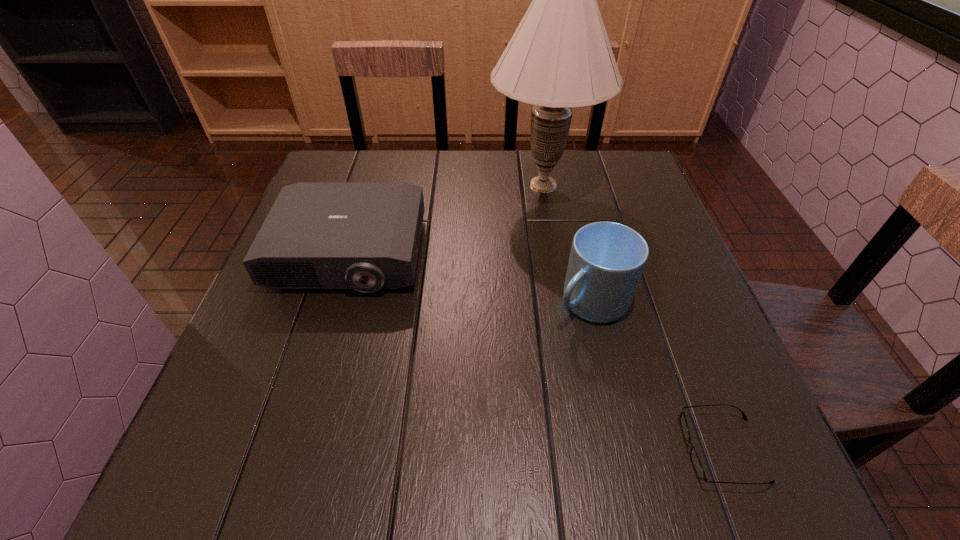
This screenshot has height=540, width=960. What are the coordinates of `vacant space located on the front-facing side of the rightmost object` in the screenshot? It's located at (613, 449).

The height and width of the screenshot is (540, 960). I want to click on free location located on the front-facing side of the rightmost object, so [x=563, y=449].

Locate an element on the screen. The height and width of the screenshot is (540, 960). object situated at the far edge is located at coordinates (560, 57).

This screenshot has width=960, height=540. Find the location of `object that is at the near edge`. object that is at the near edge is located at coordinates (696, 463).

Where is `object present at the left edge`? Image resolution: width=960 pixels, height=540 pixels. object present at the left edge is located at coordinates (365, 236).

Locate an element on the screen. This screenshot has height=540, width=960. lampshade located in the right edge section of the desktop is located at coordinates (560, 57).

In order to click on mug at the right edge in this screenshot , I will do `click(607, 259)`.

You are a GUI agent. You are given a task and a screenshot of the screen. Output one action in this format:
    pyautogui.click(x=<x>, y=<y>)
    Task: Click on the spectacles that is at the right edge
    
    Given the screenshot: What is the action you would take?
    pyautogui.click(x=696, y=463)

Identify the location of object at the far right corner. This screenshot has width=960, height=540. (560, 57).

Where is `object at the near right corner`? The height and width of the screenshot is (540, 960). object at the near right corner is located at coordinates (696, 463).